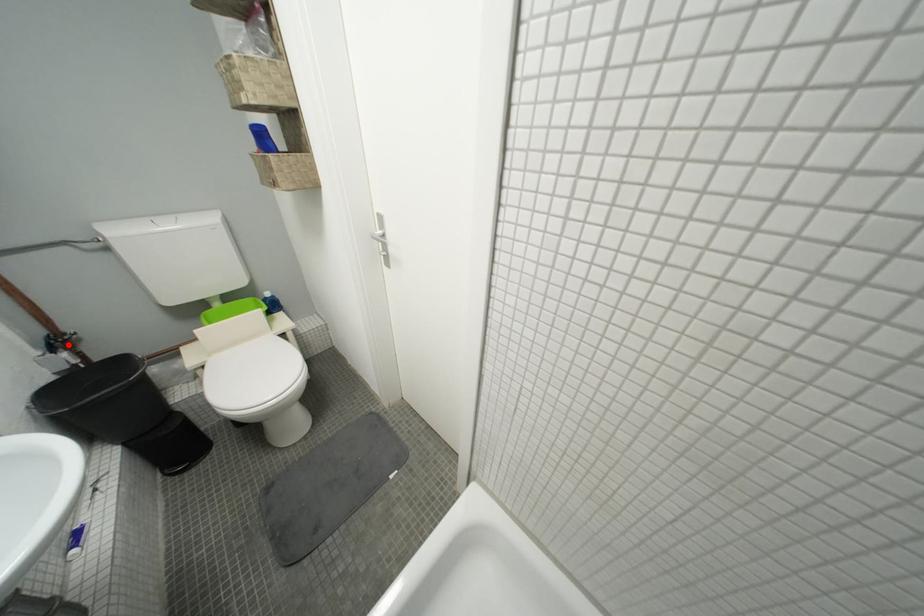
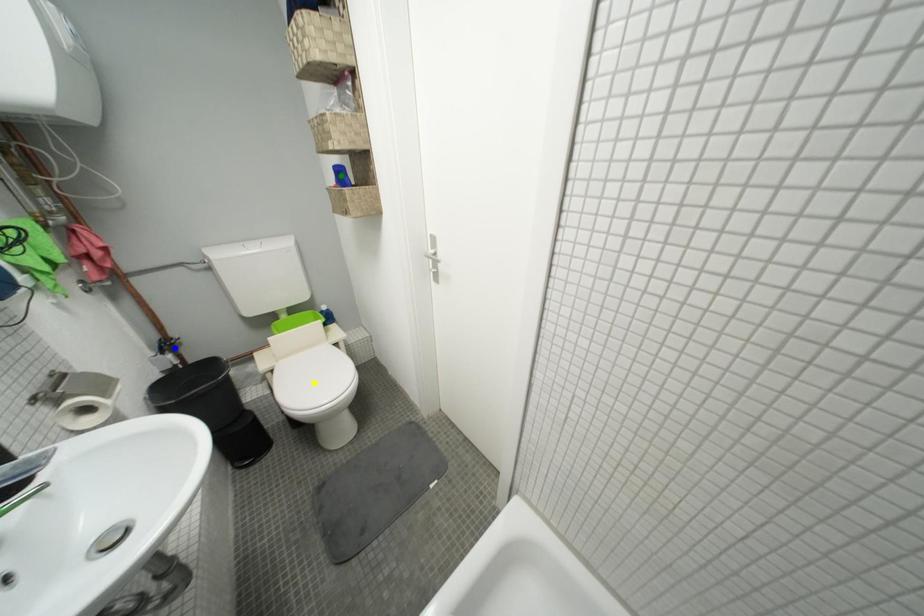
Question: I am providing you with two images of the same scene from different viewpoints. A red point is marked on the first image. You are given multiple points on the second image. In image 2, which mark is for the same physical point as the one in image 1?

Choices:
 (A) yellow point
 (B) blue point
 (C) green point

Answer: (B)